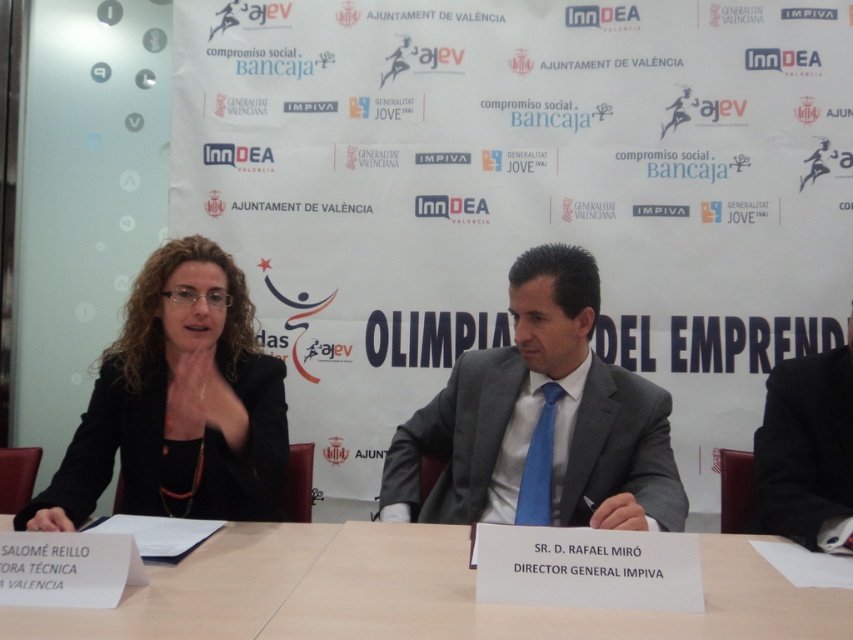
Question: Which point is closer to the camera taking this photo?

Choices:
 (A) (784, 477)
 (B) (529, 506)

Answer: (A)

Question: Among these objects, which one is nearest to the camera?

Choices:
 (A) black matte jacket at center
 (B) black suit at right
 (C) blue silk tie at center
 (D) gray suit at center

Answer: (D)

Question: Can you confirm if gray suit at center is positioned below black matte jacket at center?

Choices:
 (A) no
 (B) yes

Answer: (B)

Question: Which object is positioned closest to the black suit at right?

Choices:
 (A) black matte jacket at center
 (B) blue silk tie at center

Answer: (B)

Question: Is black matte jacket at center to the left of black suit at right from the viewer's perspective?

Choices:
 (A) no
 (B) yes

Answer: (B)

Question: Is gray suit at center behind black matte jacket at center?

Choices:
 (A) yes
 (B) no

Answer: (B)